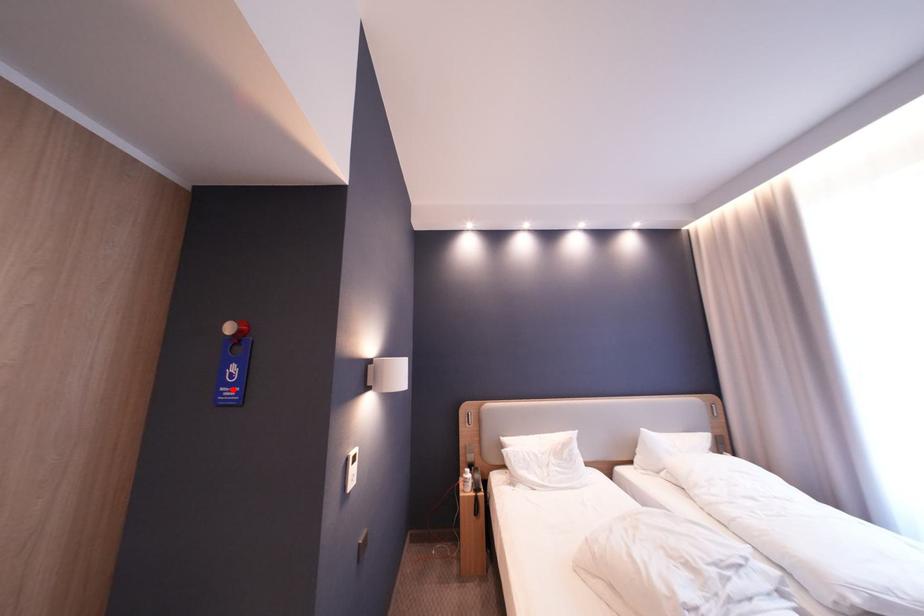
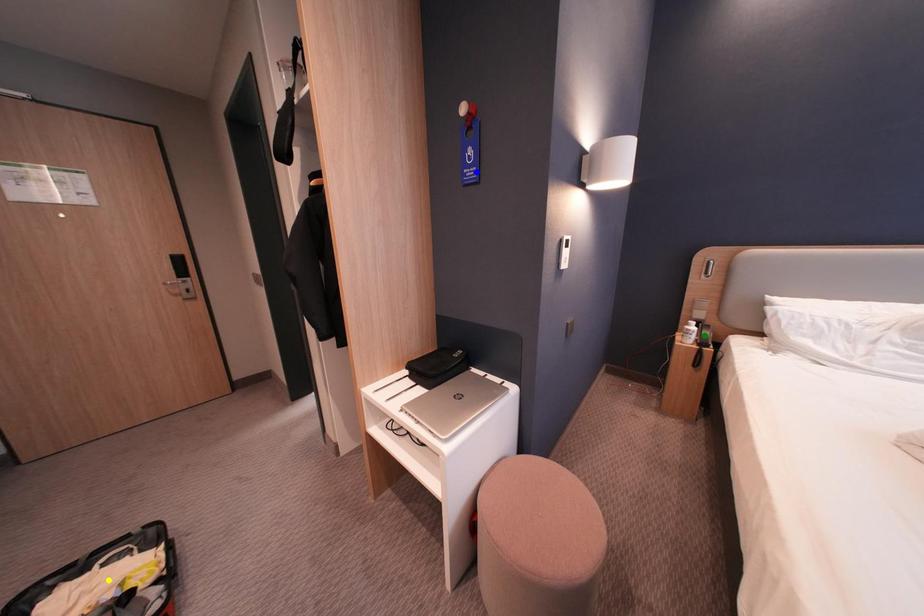
Question: I am providing you with two images of the same scene from different viewpoints. A red point is marked on the first image. You are given multiple points on the second image. In image 2, which mark is for the same physical point as the one in image 1?

Choices:
 (A) green point
 (B) blue point
 (C) yellow point

Answer: (B)